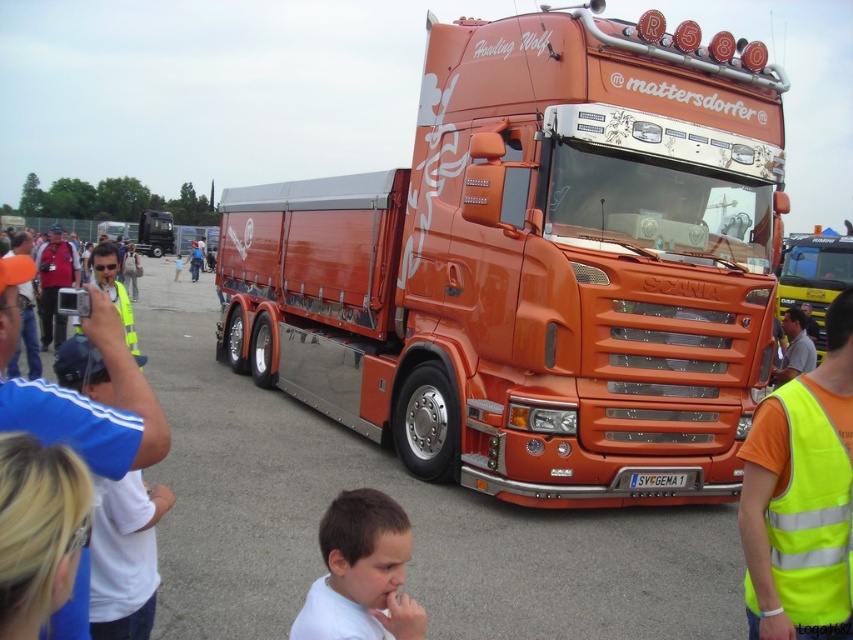
Question: Among these points, which one is nearest to the camera?

Choices:
 (A) (529, 38)
 (B) (306, 637)

Answer: (B)

Question: Can you confirm if neon yellow reflective safety vest at lower right is wider than white matte shirt at lower center?

Choices:
 (A) yes
 (B) no

Answer: (B)

Question: Which point is closer to the camera?

Choices:
 (A) (550, 461)
 (B) (814, 426)

Answer: (B)

Question: Based on their relative distances, which object is farther from the neon yellow reflective safety vest at lower right?

Choices:
 (A) white matte shirt at lower center
 (B) orange metallic truck at center

Answer: (B)

Question: Is orange metallic truck at center closer to camera compared to white matte shirt at lower center?

Choices:
 (A) no
 (B) yes

Answer: (A)

Question: Does orange metallic truck at center have a larger size compared to neon yellow reflective safety vest at lower right?

Choices:
 (A) no
 (B) yes

Answer: (A)